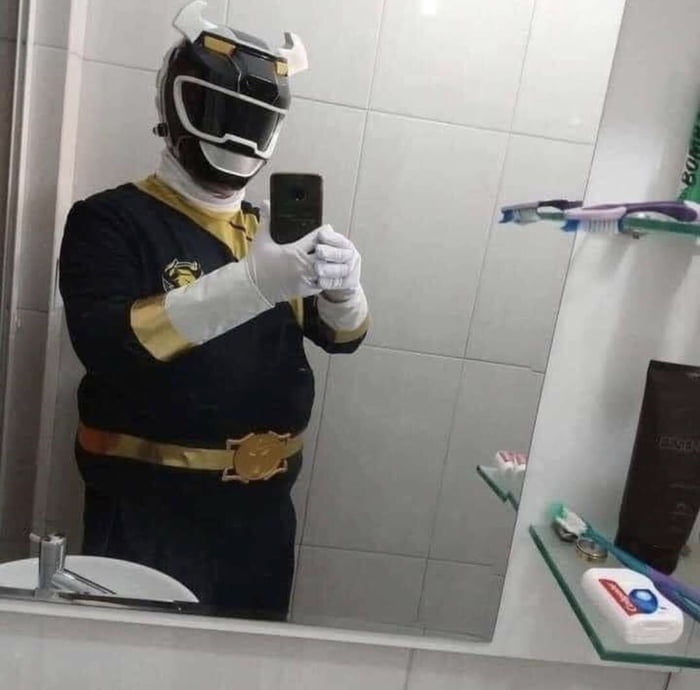
This screenshot has height=690, width=700. Identify the location of mirrow. (456, 299).